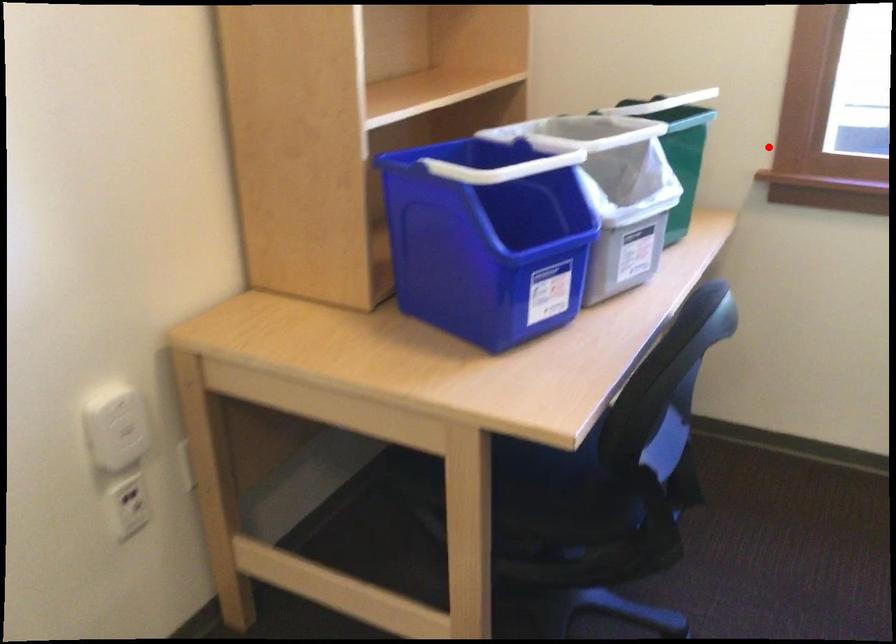
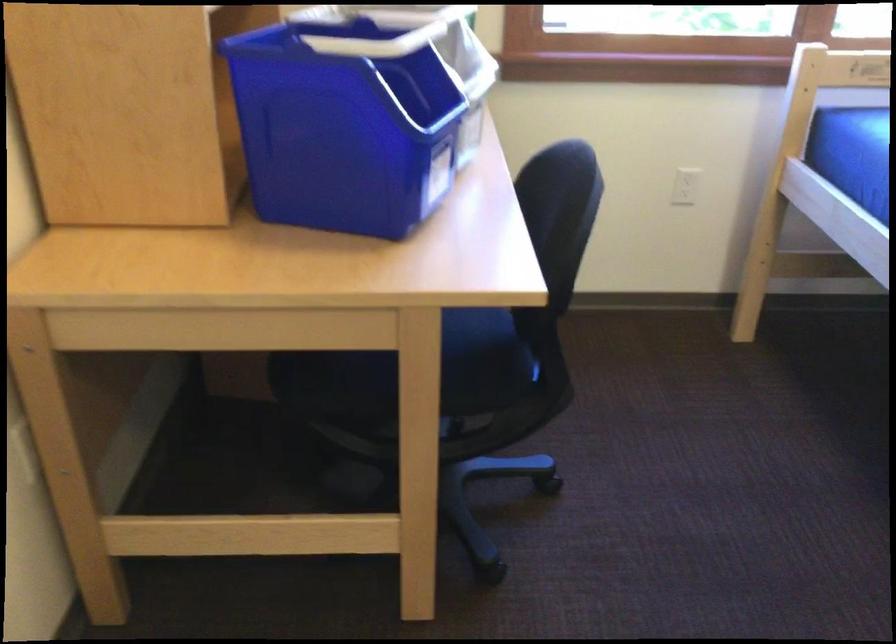
Find the pixel in the second image that matches the highlighted location in the first image.

(506, 26)